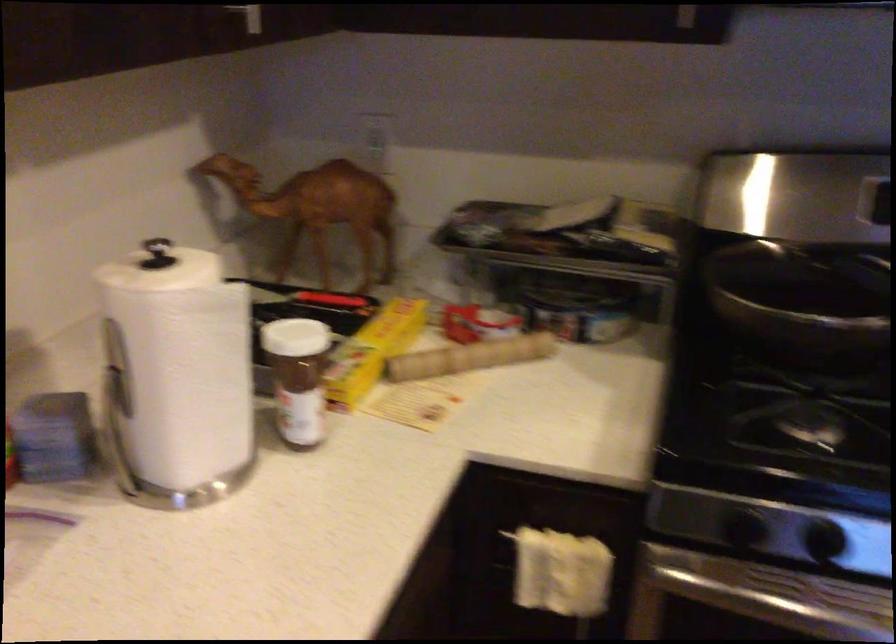
Find where to twist the white jar lid. Please return your answer as a coordinate pair (x, y).

(289, 337)